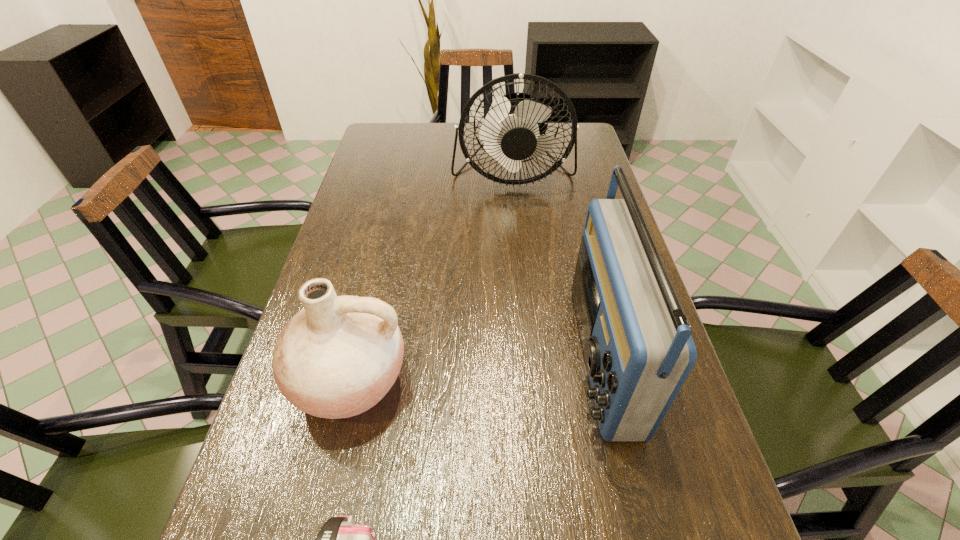
Find the location of `free space that is in between the farthest object and the pottery`. free space that is in between the farthest object and the pottery is located at coordinates (431, 276).

At what (x,y) coordinates should I click in order to perform the action: click on free space between the radio receiver and the second shortest object. Please return your answer as a coordinate pair (x, y). This screenshot has height=540, width=960. Looking at the image, I should click on (475, 368).

Where is `vacant space that's between the radio receiver and the fan`? The height and width of the screenshot is (540, 960). vacant space that's between the radio receiver and the fan is located at coordinates (557, 265).

Find the location of a particular element. This screenshot has height=540, width=960. the second closest object to the pottery is located at coordinates (638, 350).

Locate which object ranks second in proximity to the radio receiver. Please provide its 2D coordinates. Your answer should be formatted as a tuple, i.e. [(x, y)], where the tuple contains the x and y coordinates of a point satisfying the conditions above.

[(510, 132)]

Where is `vacant area in the image that satisfies the following two spatial constraints: 1. on the front panel of the radio receiver; 2. to pour from the handle of the second shortest object`? The height and width of the screenshot is (540, 960). vacant area in the image that satisfies the following two spatial constraints: 1. on the front panel of the radio receiver; 2. to pour from the handle of the second shortest object is located at coordinates (606, 380).

What are the coordinates of `vacant space that satisfies the following two spatial constraints: 1. on the front panel of the radio receiver; 2. to pour from the handle of the second shortest object` in the screenshot? It's located at (606, 380).

Find the location of a particular element. free space that satisfies the following two spatial constraints: 1. on the front panel of the radio receiver; 2. to pour from the handle of the pottery is located at coordinates 606,380.

The height and width of the screenshot is (540, 960). In order to click on vacant space that satisfies the following two spatial constraints: 1. on the front panel of the radio receiver; 2. to pour from the handle of the third tallest object in this screenshot , I will do `click(606, 380)`.